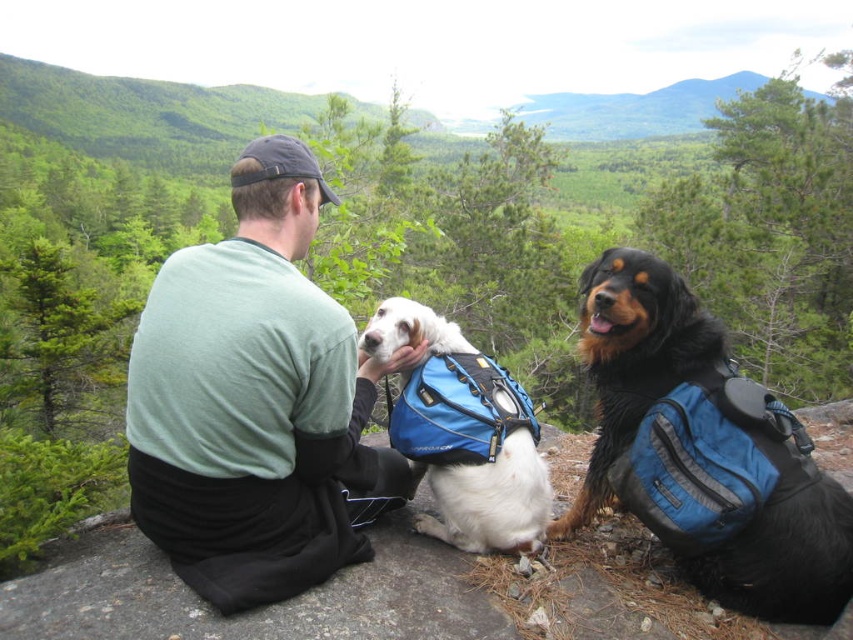
Is green cotton shirt at center to the right of white soft fur dog at center from the viewer's perspective?

No, green cotton shirt at center is not to the right of white soft fur dog at center.

Find the location of a particular element. green cotton shirt at center is located at coordinates (256, 403).

Locate an element on the screen. green cotton shirt at center is located at coordinates (256, 403).

Can you confirm if black fuzzy dog at center is positioned above white soft fur dog at center?

Correct, black fuzzy dog at center is located above white soft fur dog at center.

Is point (704, 588) in front of point (433, 525)?

Yes.

The image size is (853, 640). What are the coordinates of `black fuzzy dog at center` in the screenshot? It's located at (704, 451).

Does green cotton shirt at center have a smaller size compared to black fuzzy dog at center?

No.

Is green cotton shirt at center thinner than black fuzzy dog at center?

Incorrect, green cotton shirt at center's width is not less than black fuzzy dog at center's.

Describe the element at coordinates (256, 403) in the screenshot. I see `green cotton shirt at center` at that location.

Where is `green cotton shirt at center`? green cotton shirt at center is located at coordinates (256, 403).